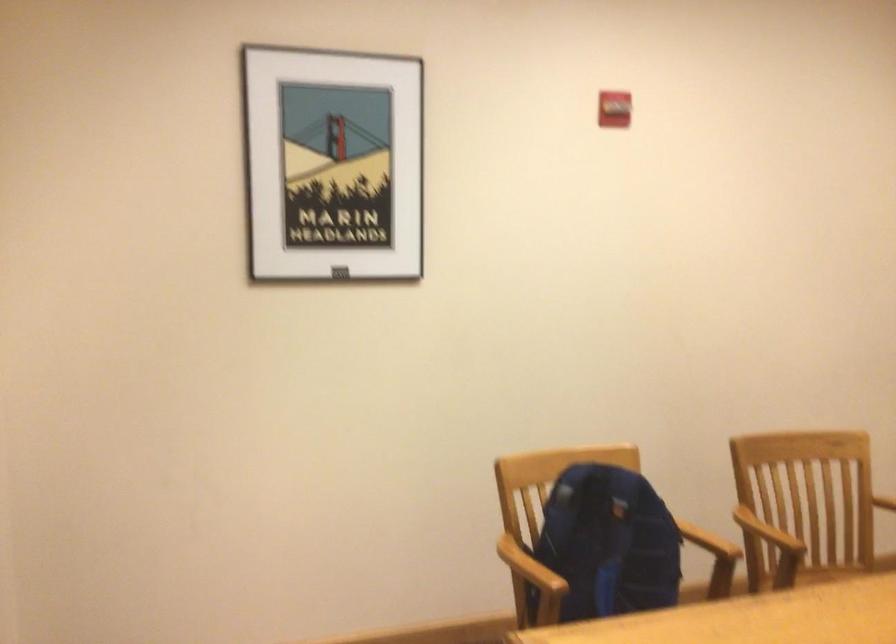
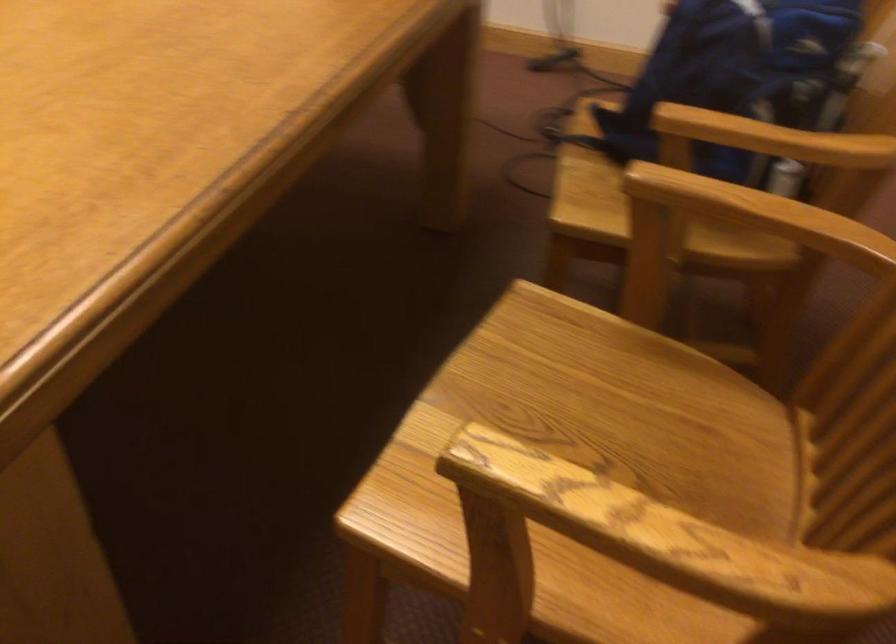
Find the pixel in the second image that matches point (651, 542) in the first image.

(736, 73)